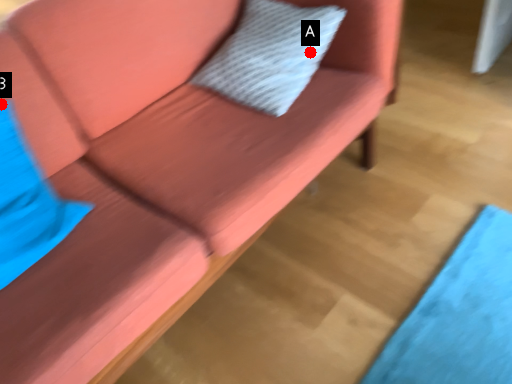
Question: Two points are circled on the image, labeled by A and B beside each circle. Which point is further to the camera?

Choices:
 (A) A is further
 (B) B is further

Answer: (A)